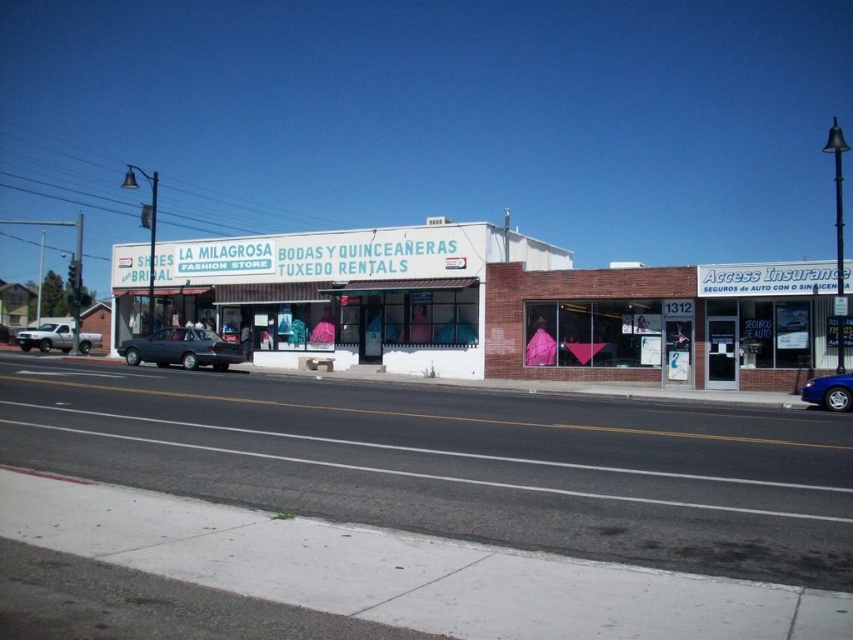
Measure the distance between point (135, 362) and camera.

Point (135, 362) is 30.73 meters away from camera.

Is matte black sedan at center smaller than blue metallic car at lower right?

Actually, matte black sedan at center might be larger than blue metallic car at lower right.

Who is more forward, (154, 348) or (846, 376)?

Point (846, 376) is more forward.

Identify the location of matte black sedan at center. The height and width of the screenshot is (640, 853). (181, 348).

Between silver metallic truck at left and blue metallic car at lower right, which one has less height?

blue metallic car at lower right is shorter.

Does silver metallic truck at left have a larger size compared to blue metallic car at lower right?

Correct, silver metallic truck at left is larger in size than blue metallic car at lower right.

Identify the location of silver metallic truck at left. (45, 337).

Who is shorter, matte black sedan at center or silver metallic truck at left?

Standing shorter between the two is silver metallic truck at left.

Can you confirm if matte black sedan at center is bigger than silver metallic truck at left?

Incorrect, matte black sedan at center is not larger than silver metallic truck at left.

Who is more forward, (212,340) or (33,337)?

Point (212,340)

Identify the location of matte black sedan at center. [181, 348].